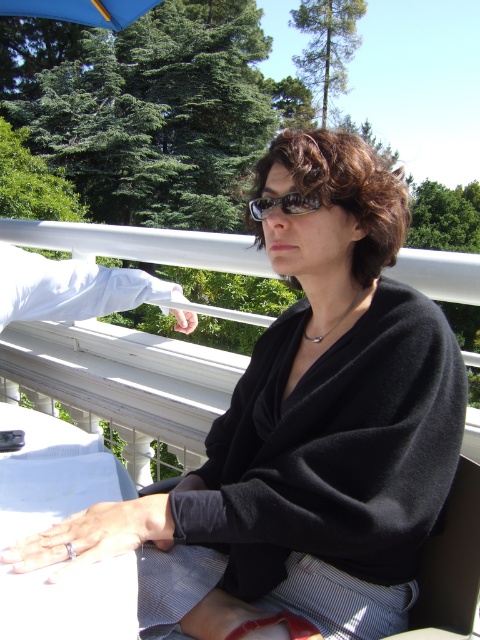
Is white glossy table at lower left in front of brown textured sunglasses at center?

That is True.

Is white glossy table at lower left above brown textured sunglasses at center?

Actually, white glossy table at lower left is below brown textured sunglasses at center.

What are the coordinates of `white glossy table at lower left` in the screenshot? It's located at (49, 472).

Locate an element on the screen. The image size is (480, 640). white glossy table at lower left is located at coordinates (49, 472).